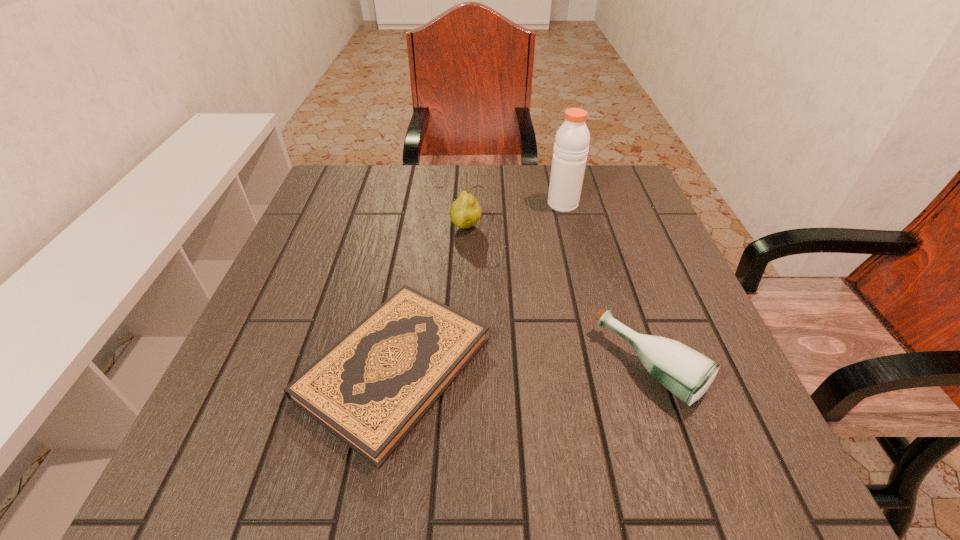
The width and height of the screenshot is (960, 540). I want to click on vacant space that's between the second shortest object and the shaker, so click(x=607, y=285).

The image size is (960, 540). Find the location of `vacant area that lies between the tallest object and the hardback book`. vacant area that lies between the tallest object and the hardback book is located at coordinates (479, 286).

This screenshot has height=540, width=960. In order to click on vacant point located between the third nearest object and the bottle in this screenshot , I will do `click(559, 297)`.

This screenshot has height=540, width=960. I want to click on vacant point located between the farthest object and the pear, so click(x=515, y=216).

Locate an element on the screen. blank region between the farthest object and the shortest object is located at coordinates (479, 286).

At what (x,y) coordinates should I click in order to perform the action: click on vacant space that's between the shaker and the third shortest object. Please return your answer as a coordinate pair (x, y). The height and width of the screenshot is (540, 960). Looking at the image, I should click on (515, 216).

This screenshot has width=960, height=540. What are the coordinates of `free space between the bottle and the shortest object` in the screenshot? It's located at (522, 367).

Choose which object is the second nearest neighbor to the tallest object. Please provide its 2D coordinates. Your answer should be formatted as a tuple, i.e. [(x, y)], where the tuple contains the x and y coordinates of a point satisfying the conditions above.

[(370, 389)]

Identify the location of object that is the closest one to the hardback book. (686, 373).

You are a GUI agent. You are given a task and a screenshot of the screen. Output one action in this format:
    pyautogui.click(x=<x>, y=<y>)
    Task: Click on the free point that satisfies the following two spatial constraints: 1. on the back side of the bottle; 2. on the left side of the hardback book
    The width and height of the screenshot is (960, 540).
    Given the screenshot: What is the action you would take?
    pyautogui.click(x=395, y=367)